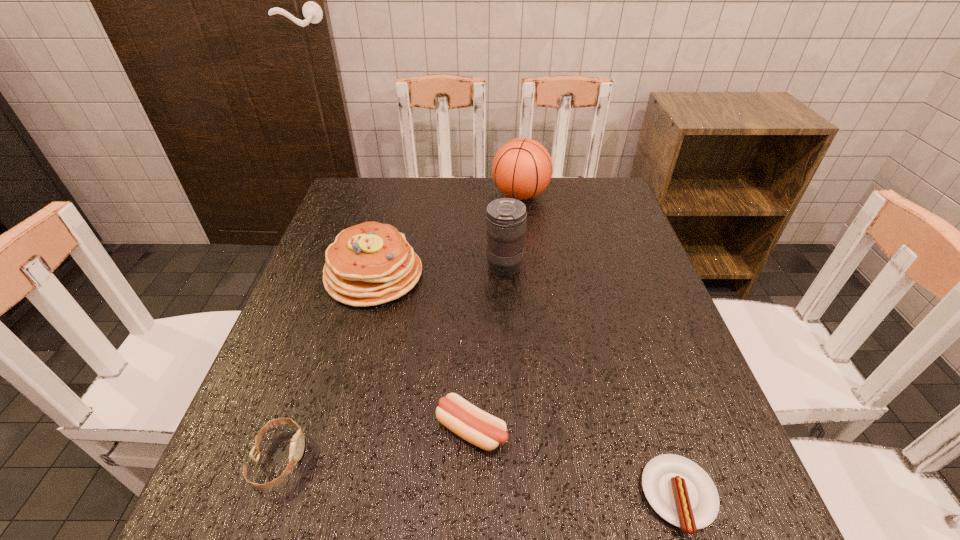
Where is `the farthest object`? Image resolution: width=960 pixels, height=540 pixels. the farthest object is located at coordinates (522, 168).

This screenshot has width=960, height=540. I want to click on telephoto lens, so click(x=506, y=218).

Where is `the third tallest object`? The height and width of the screenshot is (540, 960). the third tallest object is located at coordinates (371, 263).

You are a GUI agent. You are given a task and a screenshot of the screen. Output one action in this format:
    pyautogui.click(x=<x>, y=<y>)
    Task: Click on the watch
    This screenshot has height=540, width=960.
    Given the screenshot: What is the action you would take?
    coord(297,444)

Locate an element on the screen. Image resolution: width=960 pixels, height=540 pixels. the taller sausage is located at coordinates (472, 424).

Image resolution: width=960 pixels, height=540 pixels. Find the location of `the right sausage`. the right sausage is located at coordinates (679, 490).

Locate an element on the screen. This screenshot has width=960, height=540. the shortest object is located at coordinates (679, 490).

Image resolution: width=960 pixels, height=540 pixels. Find the location of `vacant space positioned on the right of the farthest object`. vacant space positioned on the right of the farthest object is located at coordinates (569, 195).

The width and height of the screenshot is (960, 540). I want to click on free space located on the side of the telephoto lens where the control switches are located, so click(340, 266).

The width and height of the screenshot is (960, 540). Identify the location of free space located on the side of the telephoto lens where the control switches are located. (380, 266).